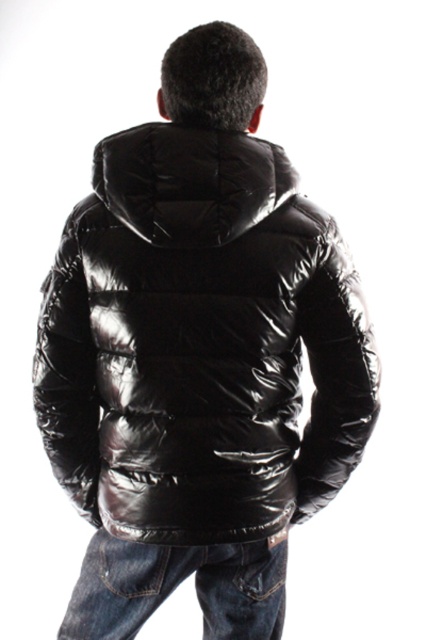
You are standing at the point labeled as point [268,148] and want to take a photo of the person in the shiny black puffer jacket. If your camera is 3.95 feet away from you, will you be able to capture the entire jacket in the photo?

Yes, since the camera is 3.95 feet away from point [268,148], which is your position, the entire jacket should be in frame as the distance is sufficient for capturing the subject at that range.

You are a fashion designer trying to create a new outfit that matches the glossy black puffer jacket at center and the denim jeans at lower center. Based on the image, which clothing item has a greater width?

The glossy black puffer jacket at center has a greater width than the denim jeans at lower center.